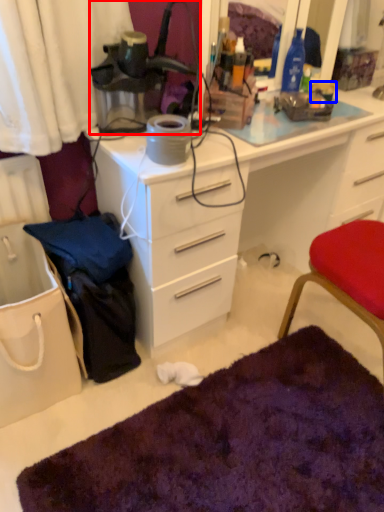
Question: Which of the following is the farthest to the observer, lamp (highlighted by a red box) or coffee cup (highlighted by a blue box)?

Choices:
 (A) lamp
 (B) coffee cup

Answer: (B)